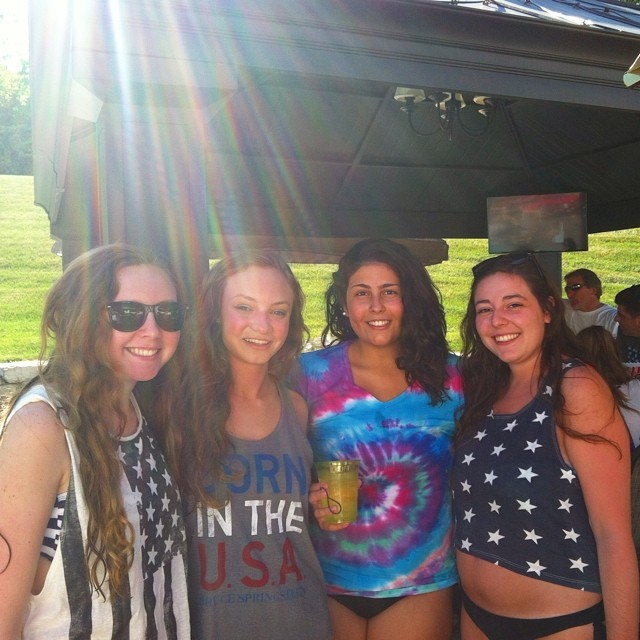
Identify the location of liquor. The height and width of the screenshot is (640, 640). (332, 505).